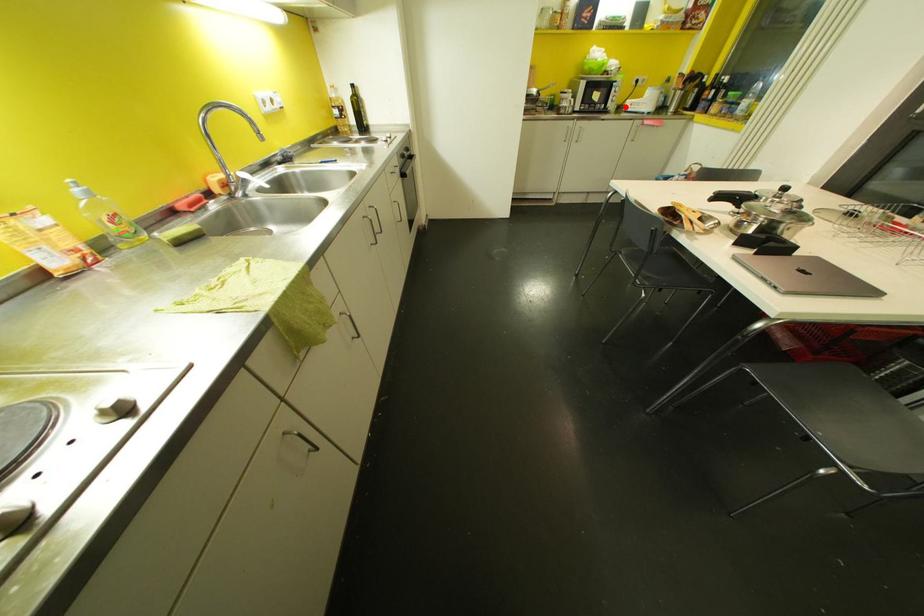
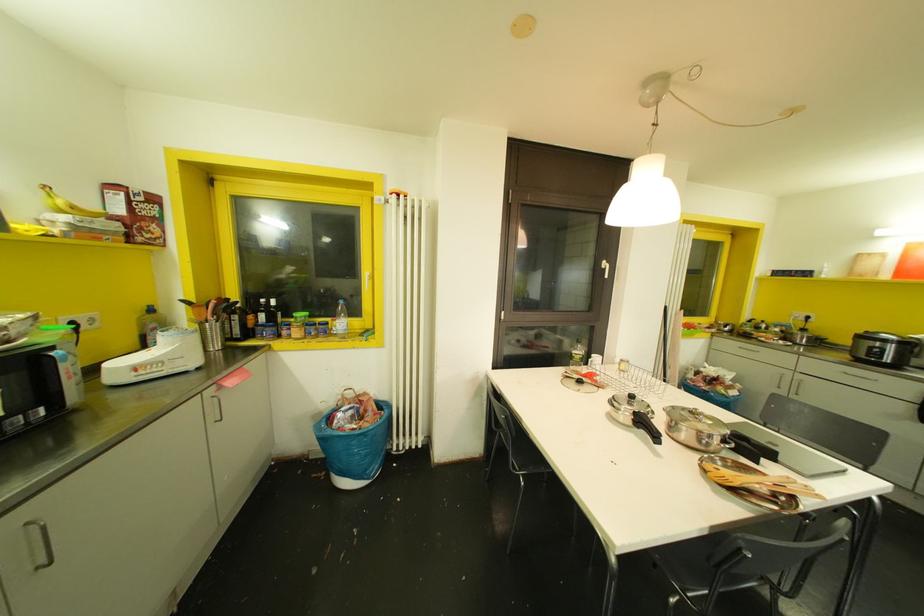
Locate, in the second image, the point that corresponds to the highlighted location in the first image.

(116, 378)